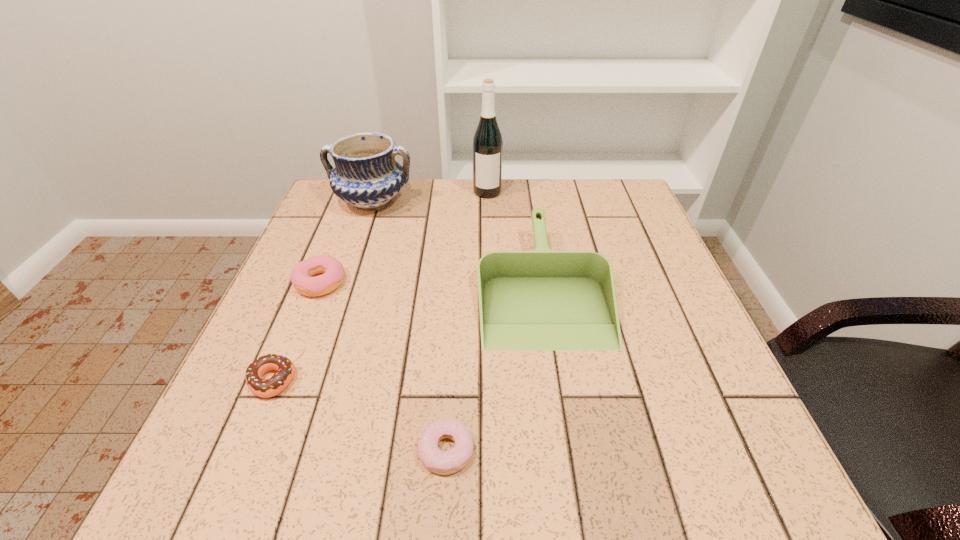
I want to click on free space that satisfies the following two spatial constraints: 1. on the back side of the fifth shortest object; 2. on the left side of the third shortest object, so click(352, 201).